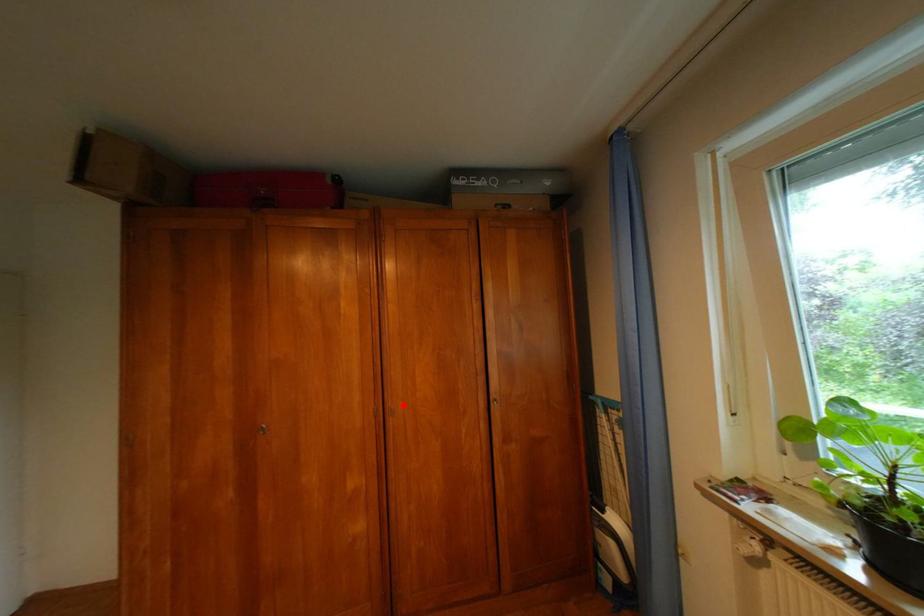
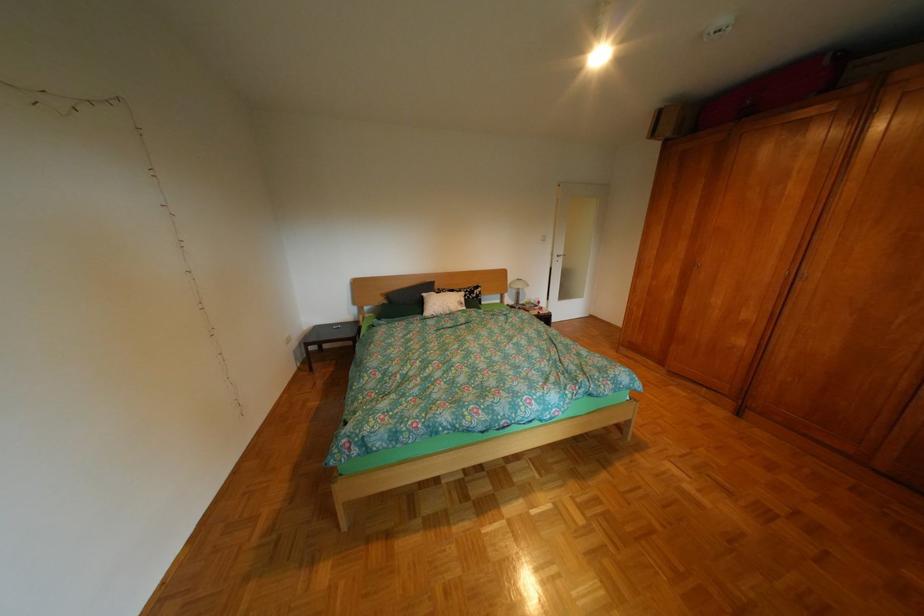
Question: I am providing you with two images of the same scene from different viewpoints. A red point is marked on the first image. At the location where the point appears in image 1, is it still visible in image 2?

Choices:
 (A) Yes
 (B) No

Answer: (A)